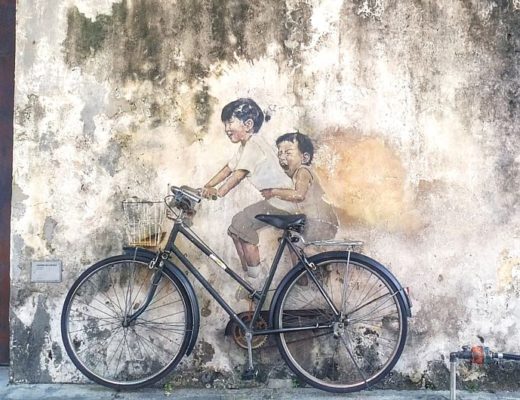
Locate an element on the screen. This screenshot has height=400, width=520. fork is located at coordinates (139, 312).